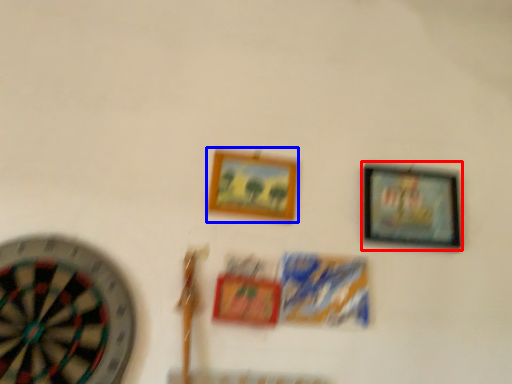
Question: Among these objects, which one is nearest to the camera, picture frame (highlighted by a red box) or picture frame (highlighted by a blue box)?

Choices:
 (A) picture frame
 (B) picture frame

Answer: (B)